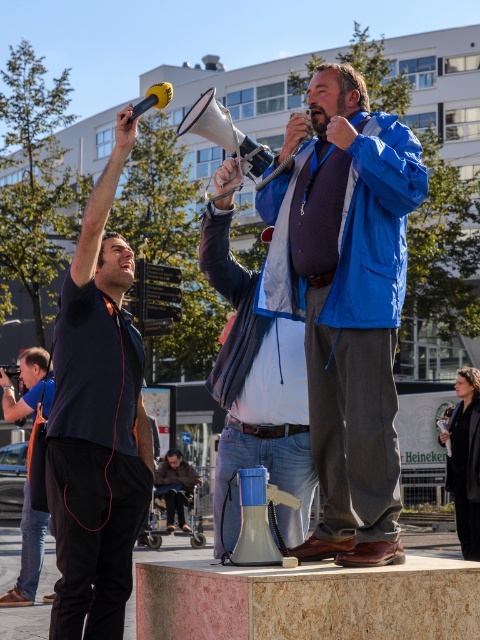
You are a photographer at the event and need to capture both the black matte shirt at left and the matte black camera at lower left in a single frame. Which object should you focus on to ensure both are visible without zooming in too much?

Since the black matte shirt at left occupies less space than the matte black camera at lower left, you should focus on the matte black camera at lower left as it takes up more space and will be easier to frame while keeping the smaller black matte shirt at left in the shot.

You are a photographer at the event. You need to take a photo that includes both the blue fabric jacket at center and the matte black camera at lower left. Which object should you position closer to the front of the frame to ensure both are visible?

The blue fabric jacket at center is much taller than the matte black camera at lower left. To ensure both are visible in the photo, position the matte black camera at lower left closer to the front of the frame so its smaller size doesn